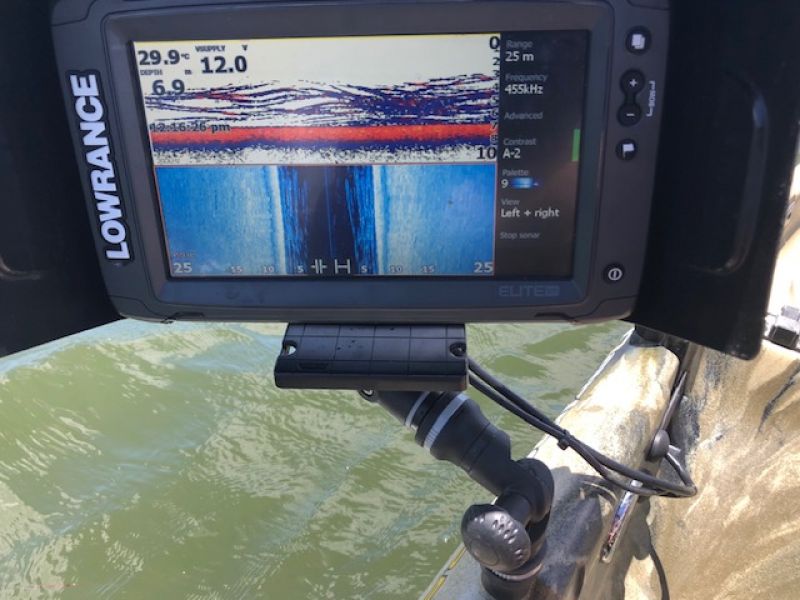
Identify the location of stand. This screenshot has height=600, width=800. (405, 353).